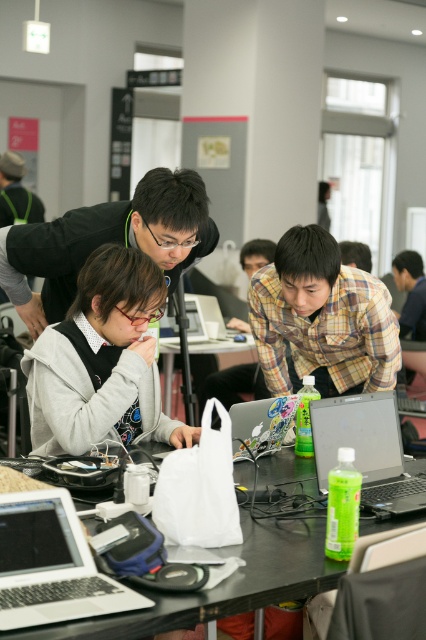
Question: Does black plastic table at center have a lesser width compared to matte plastic laptop at center?

Choices:
 (A) no
 (B) yes

Answer: (A)

Question: Among these points, which one is nearest to the camera?

Choices:
 (A) (360, 452)
 (B) (213, 316)
 (C) (187, 312)

Answer: (A)

Question: Considering the real-world distances, which object is farthest from the gray matte hoodie at center?

Choices:
 (A) silver metallic laptop at center
 (B) black plastic table at center

Answer: (A)

Question: Can you confirm if metallic silver laptop at center is positioned below matte black laptop at center?

Choices:
 (A) yes
 (B) no

Answer: (A)

Question: Can you confirm if black plastic table at center is thinner than white plastic bag at center?

Choices:
 (A) yes
 (B) no

Answer: (B)

Question: Which of the following is the farthest from the observer?

Choices:
 (A) matte black laptop at center
 (B) black plastic table at center
 (C) white plastic bag at center

Answer: (C)